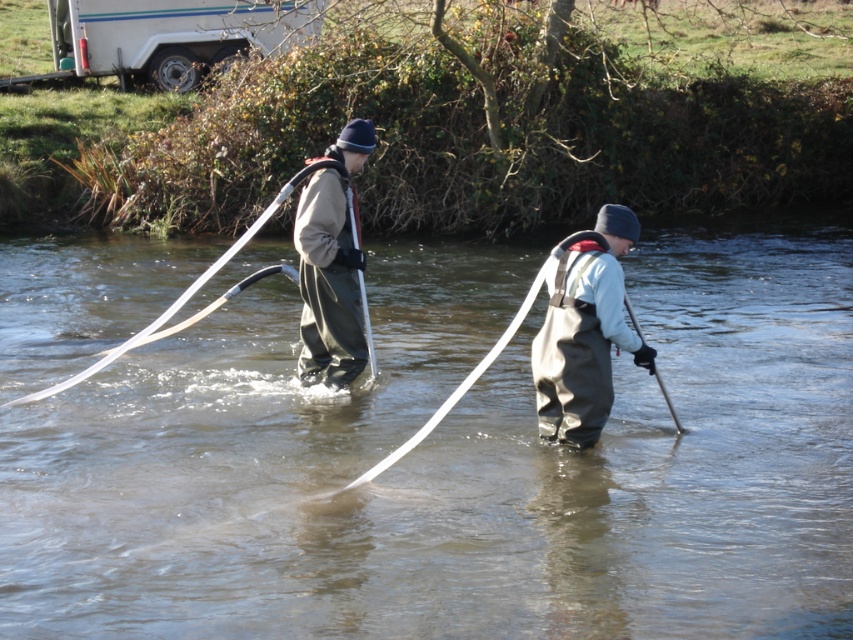
Does brown rubber boots at center appear on the right side of matte gray waders at center?

Correct, you'll find brown rubber boots at center to the right of matte gray waders at center.

Who is positioned more to the left, brown rubber boots at center or matte gray waders at center?

matte gray waders at center

Where is `brown rubber boots at center`? This screenshot has width=853, height=640. brown rubber boots at center is located at coordinates (457, 464).

Is gray rubber waders at center further to camera compared to matte gray waders at center?

No, it is not.

Can you confirm if gray rubber waders at center is smaller than matte gray waders at center?

Yes.

The image size is (853, 640). Describe the element at coordinates (585, 332) in the screenshot. I see `gray rubber waders at center` at that location.

Find the location of a particular element. Image resolution: width=853 pixels, height=640 pixels. gray rubber waders at center is located at coordinates [585, 332].

Can you confirm if brown rubber boots at center is positioned to the left of gray rubber waders at center?

Yes, brown rubber boots at center is to the left of gray rubber waders at center.

Is brown rubber boots at center smaller than gray rubber waders at center?

No.

Is point (381, 496) more distant than point (654, 355)?

That is False.

You are a GUI agent. You are given a task and a screenshot of the screen. Output one action in this format:
    pyautogui.click(x=<x>, y=<y>)
    Task: Click on the brown rubber boots at center
    This screenshot has width=853, height=640.
    Given the screenshot: What is the action you would take?
    pyautogui.click(x=457, y=464)